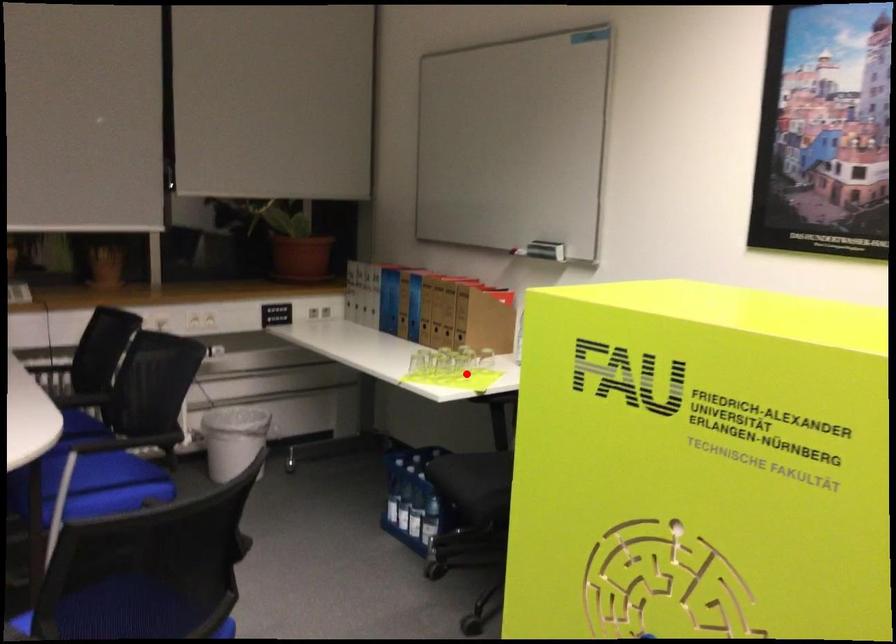
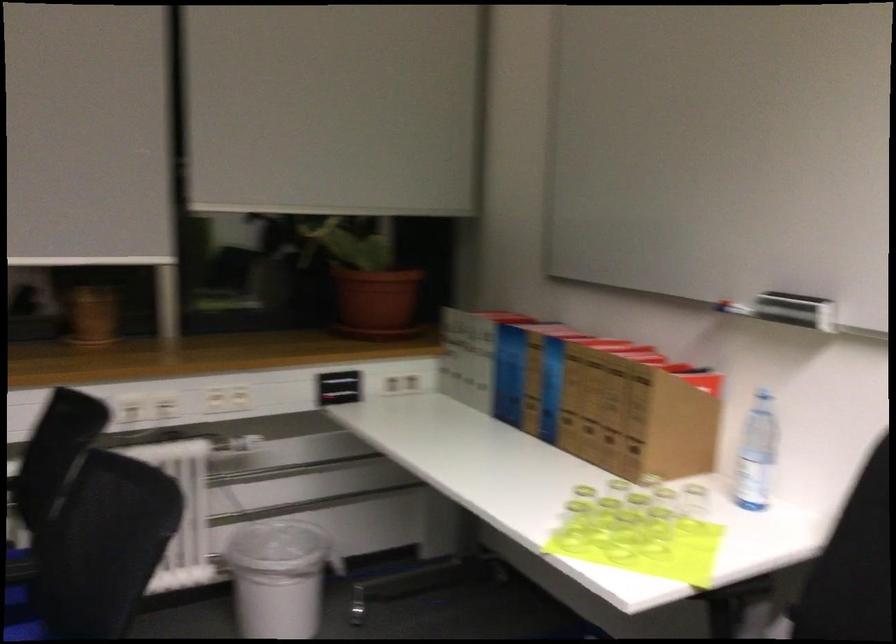
Question: A red point is marked in image1. In image2, is the corresponding 3D point closer to the camera or farther? Reply with the corresponding letter.

Choices:
 (A) The corresponding 3D point is closer.
 (B) The corresponding 3D point is farther.

Answer: (A)